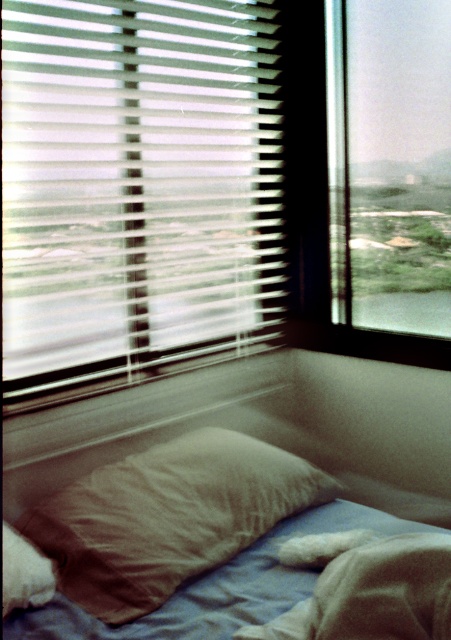
Question: Among these points, which one is farthest from the camera?

Choices:
 (A) (417, 246)
 (B) (203, 467)

Answer: (A)

Question: Considering the relative positions of white translucent blinds at upper left and transparent glass window at upper right in the image provided, where is white translucent blinds at upper left located with respect to transparent glass window at upper right?

Choices:
 (A) above
 (B) below

Answer: (B)

Question: Is transparent glass window at upper right wider than brown cotton pillow at center?

Choices:
 (A) no
 (B) yes

Answer: (A)

Question: Among these objects, which one is nearest to the camera?

Choices:
 (A) brown cotton pillow at center
 (B) blue cotton sheet at lower left
 (C) white translucent blinds at upper left
 (D) transparent glass window at upper right

Answer: (B)

Question: Does white translucent blinds at upper left have a smaller size compared to blue cotton sheet at lower left?

Choices:
 (A) yes
 (B) no

Answer: (B)

Question: Among these objects, which one is nearest to the camera?

Choices:
 (A) white translucent blinds at upper left
 (B) transparent glass window at upper right

Answer: (A)